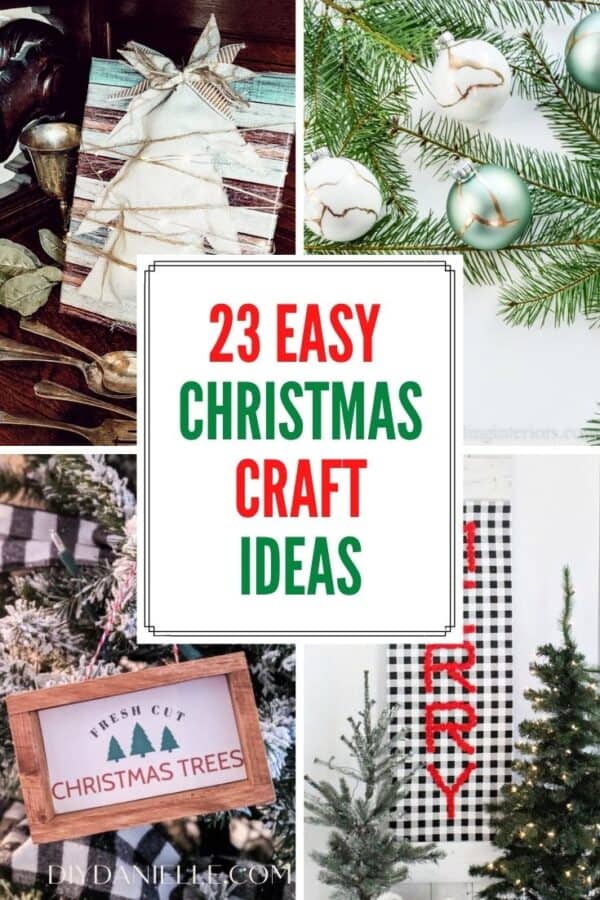
This screenshot has height=900, width=600. What are the coordinates of `ornaments` in the screenshot? It's located at (490, 194), (327, 182), (597, 60).